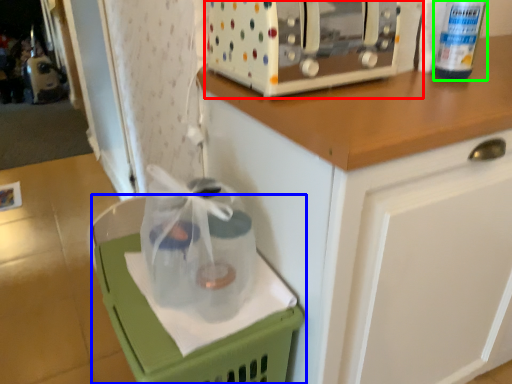
Question: Based on their relative distances, which object is farther from home appliance (highlighted by a red box)? Choose from basket (highlighted by a blue box) and bottle (highlighted by a green box).

Choices:
 (A) basket
 (B) bottle

Answer: (A)